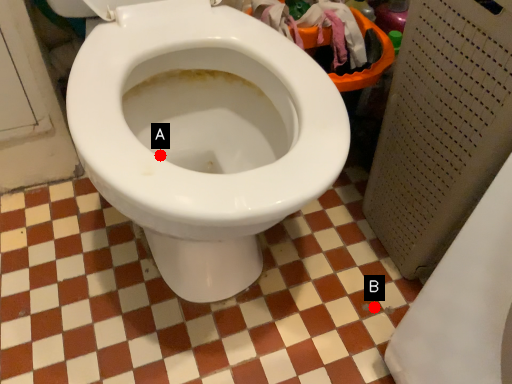
Question: Two points are circled on the image, labeled by A and B beside each circle. Which of the following is the farthest from the observer?

Choices:
 (A) A is further
 (B) B is further

Answer: (B)